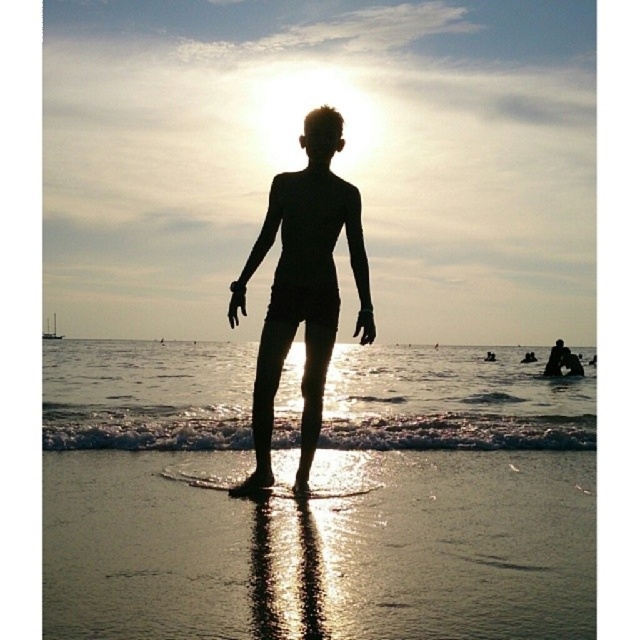
Question: Which object is the closest to the shiny sand at lower center?

Choices:
 (A) translucent wet sand at lower center
 (B) transparent plastic surfboard at center
 (C) black matte figure at center

Answer: (B)

Question: Which object is farther from the camera taking this photo?

Choices:
 (A) black matte figure at center
 (B) shiny sand at lower center
 (C) translucent wet sand at lower center

Answer: (C)

Question: From the image, what is the correct spatial relationship of translucent wet sand at lower center in relation to transparent plastic surfboard at center?

Choices:
 (A) left
 (B) right

Answer: (A)

Question: Can you confirm if black matte figure at center is positioned to the right of transparent plastic surfboard at center?

Choices:
 (A) yes
 (B) no

Answer: (B)

Question: Which object is the closest to the black matte figure at center?

Choices:
 (A) translucent wet sand at lower center
 (B) transparent plastic surfboard at center

Answer: (B)

Question: Does translucent wet sand at lower center appear on the right side of transparent plastic surfboard at center?

Choices:
 (A) no
 (B) yes

Answer: (A)